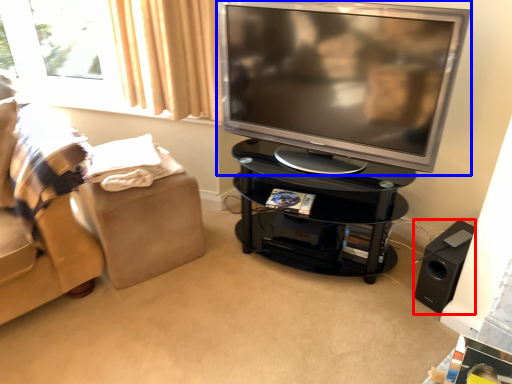
Question: Among these objects, which one is nearest to the camera, speaker (highlighted by a red box) or television (highlighted by a blue box)?

Choices:
 (A) speaker
 (B) television

Answer: (B)